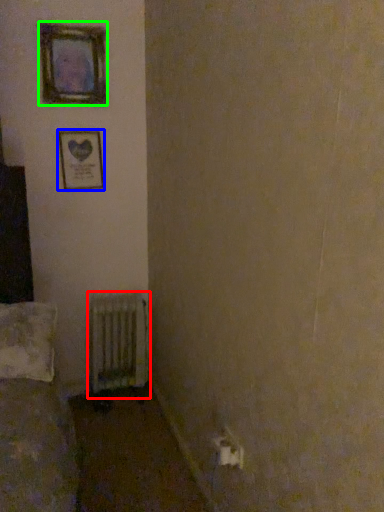
Question: Which is nearer to the radiator (highlighted by a red box)? picture frame (highlighted by a blue box) or picture frame (highlighted by a green box).

Choices:
 (A) picture frame
 (B) picture frame

Answer: (A)